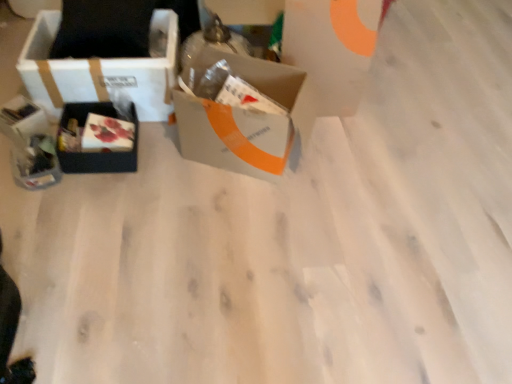
Where is `vacant area that is in front of matte black box at left, the second box viewed from the left`? The width and height of the screenshot is (512, 384). vacant area that is in front of matte black box at left, the second box viewed from the left is located at coordinates (90, 202).